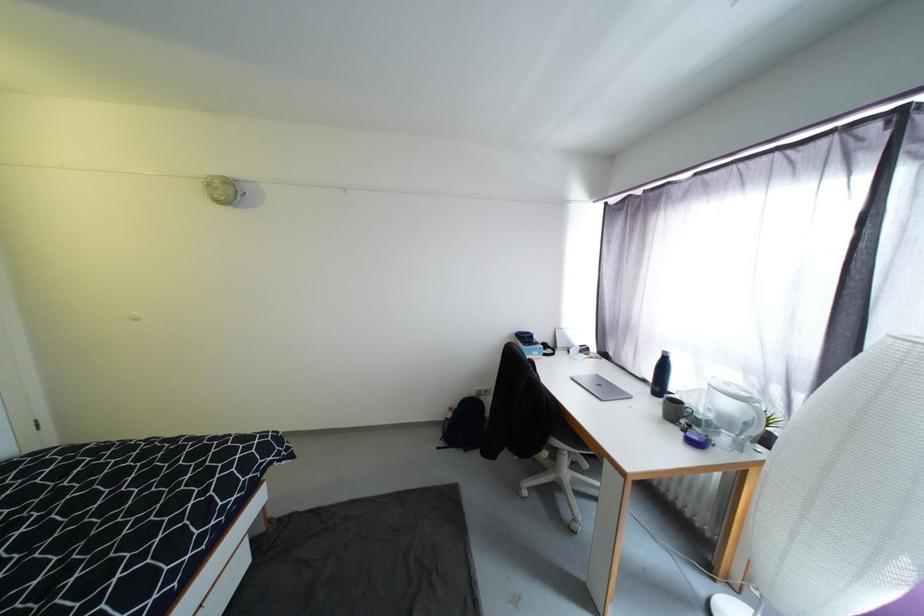
Find where to lift the grey mug handle. Please return your answer as a coordinate pair (x, y).

(693, 411)